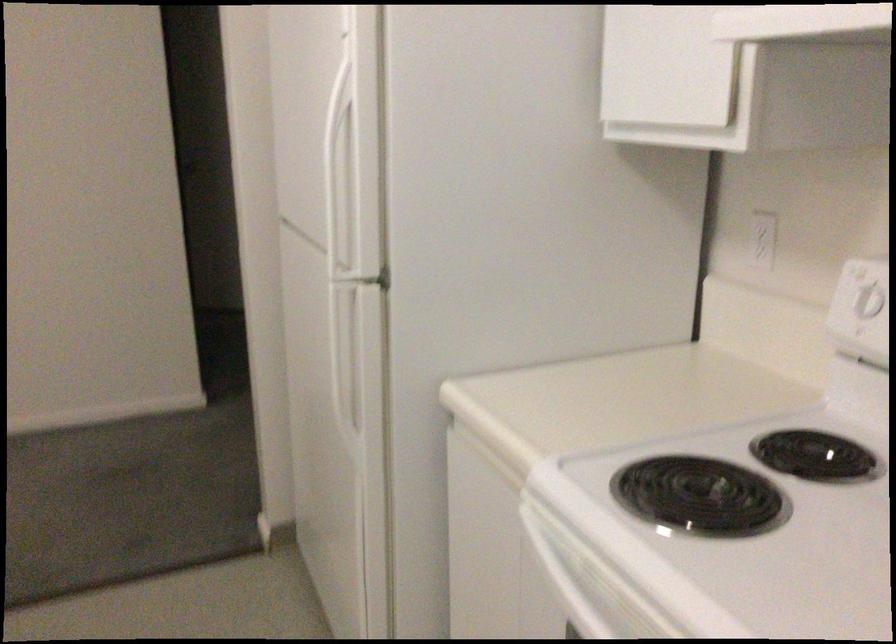
Locate an element on the screen. This screenshot has height=644, width=896. white stove knob is located at coordinates (864, 289).